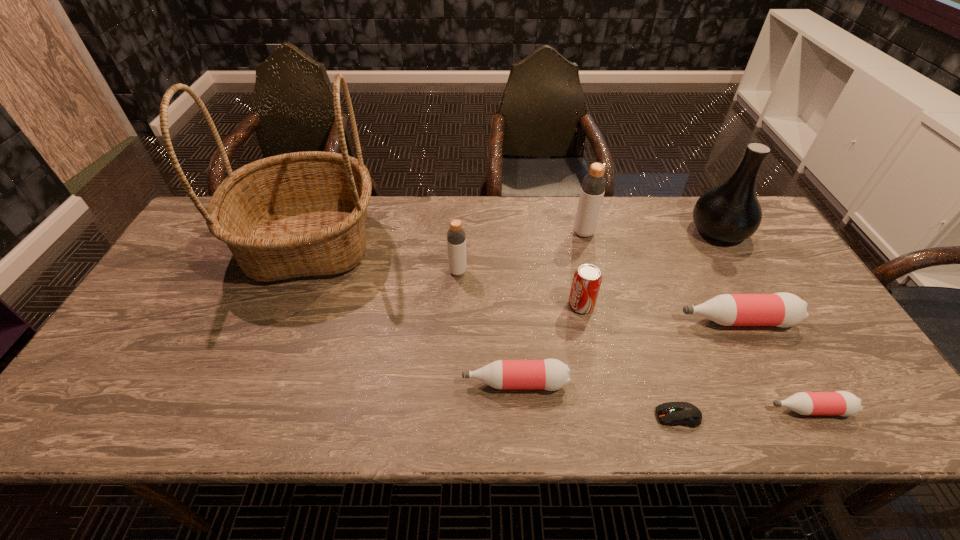
The height and width of the screenshot is (540, 960). Find the location of `object that is at the far right corner`. object that is at the far right corner is located at coordinates (731, 212).

Locate an element on the screen. This screenshot has width=960, height=540. object at the near right corner is located at coordinates (843, 403).

Identify the location of vacant space at the far edge of the desktop. This screenshot has width=960, height=540. (503, 216).

At what (x,y) coordinates should I click in order to perform the action: click on free location at the near edge. Please return your answer as a coordinate pair (x, y). This screenshot has height=540, width=960. Looking at the image, I should click on (520, 398).

Find the location of a particular element. free space at the left edge of the desktop is located at coordinates (116, 355).

The image size is (960, 540). What are the coordinates of `vacant space at the right edge of the desktop` in the screenshot? It's located at (835, 379).

In order to click on vacant region between the shortest bottle and the fourth farthest bottle in this screenshot , I will do `click(662, 396)`.

You are a GUI agent. You are given a task and a screenshot of the screen. Output one action in this format:
    pyautogui.click(x=<x>, y=<y>)
    Task: Click on the unoccupied area between the second tallest bottle and the tallest object
    
    Given the screenshot: What is the action you would take?
    pyautogui.click(x=384, y=258)

Image resolution: width=960 pixels, height=540 pixels. I want to click on vacant region between the soda can and the vase, so click(x=650, y=268).

The image size is (960, 540). Identify the location of free space between the leftmost object and the biggest pink bottle. (523, 282).